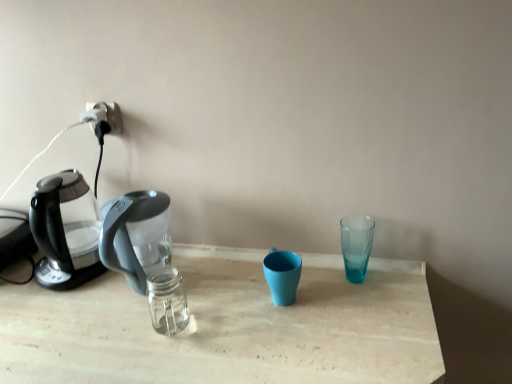
Question: Would you say transparent plastic kettle at left is part of matte blue cup at center, the 2th coffee cup when ordered from right to left,'s contents?

Choices:
 (A) yes
 (B) no

Answer: (B)

Question: Considering the relative sizes of matte blue cup at center, which is counted as the 1th coffee cup, starting from the left, and transparent plastic kettle at left in the image provided, is matte blue cup at center, which is counted as the 1th coffee cup, starting from the left, bigger than transparent plastic kettle at left?

Choices:
 (A) yes
 (B) no

Answer: (B)

Question: Is matte blue cup at center, which is counted as the 1th coffee cup, starting from the left, facing away from transparent plastic kettle at left?

Choices:
 (A) yes
 (B) no

Answer: (B)

Question: Does matte blue cup at center, the 2th coffee cup when ordered from right to left, have a lesser width compared to transparent plastic kettle at left?

Choices:
 (A) no
 (B) yes

Answer: (B)

Question: Are matte blue cup at center, the 2th coffee cup when ordered from right to left, and transparent plastic kettle at left far apart?

Choices:
 (A) yes
 (B) no

Answer: (B)

Question: Is transparent plastic kettle at left to the left or to the right of transparent glass at right, which is counted as the 2th coffee cup, starting from the left, in the image?

Choices:
 (A) right
 (B) left

Answer: (B)

Question: Considering their positions, is transparent plastic kettle at left located in front of or behind transparent glass at right, which is counted as the 2th coffee cup, starting from the left?

Choices:
 (A) front
 (B) behind

Answer: (A)

Question: From a real-world perspective, is transparent plastic kettle at left physically located above or below transparent glass at right, which is counted as the 2th coffee cup, starting from the left?

Choices:
 (A) below
 (B) above

Answer: (B)

Question: Considering the positions of point coord(64,226) and point coord(354,228), is point coord(64,226) closer or farther from the camera than point coord(354,228)?

Choices:
 (A) closer
 (B) farther

Answer: (B)

Question: From the image's perspective, is transparent glass at right, which is counted as the 2th coffee cup, starting from the left, located above or below white plastic plug at upper left?

Choices:
 (A) above
 (B) below

Answer: (B)

Question: Looking at the image, does transparent glass at right, which is counted as the 2th coffee cup, starting from the left, seem bigger or smaller compared to white plastic plug at upper left?

Choices:
 (A) small
 (B) big

Answer: (B)

Question: Is transparent glass at right, the first coffee cup in the right-to-left sequence, wider or thinner than white plastic plug at upper left?

Choices:
 (A) thin
 (B) wide

Answer: (B)

Question: Considering the relative positions of transparent glass at right, which is counted as the 2th coffee cup, starting from the left, and white plastic plug at upper left in the image provided, is transparent glass at right, which is counted as the 2th coffee cup, starting from the left, to the left or to the right of white plastic plug at upper left?

Choices:
 (A) left
 (B) right

Answer: (B)

Question: Considering the positions of point (270, 274) and point (342, 240), is point (270, 274) closer or farther from the camera than point (342, 240)?

Choices:
 (A) farther
 (B) closer

Answer: (B)

Question: Is matte blue cup at center, the 2th coffee cup when ordered from right to left, inside or outside of transparent glass at right, which is counted as the 2th coffee cup, starting from the left?

Choices:
 (A) outside
 (B) inside

Answer: (A)